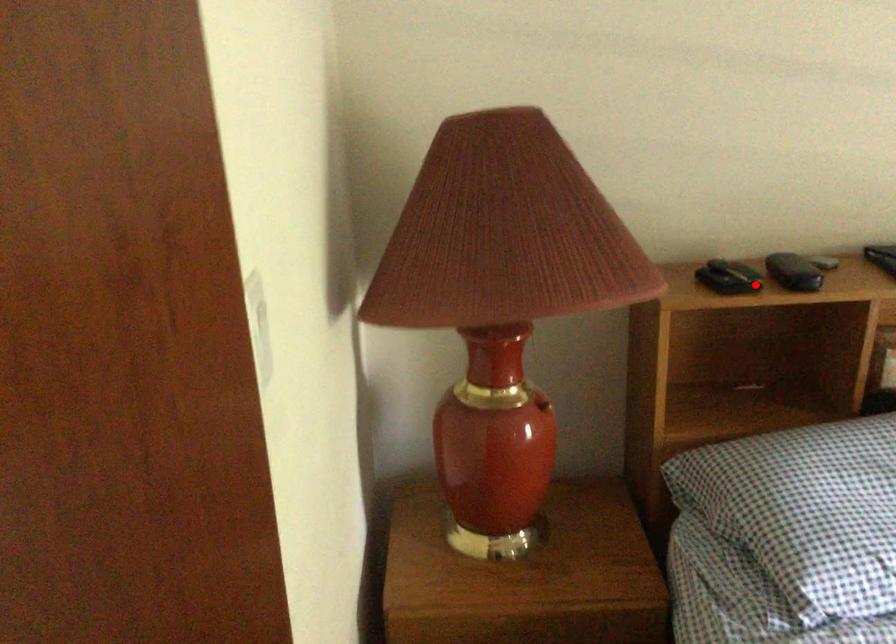
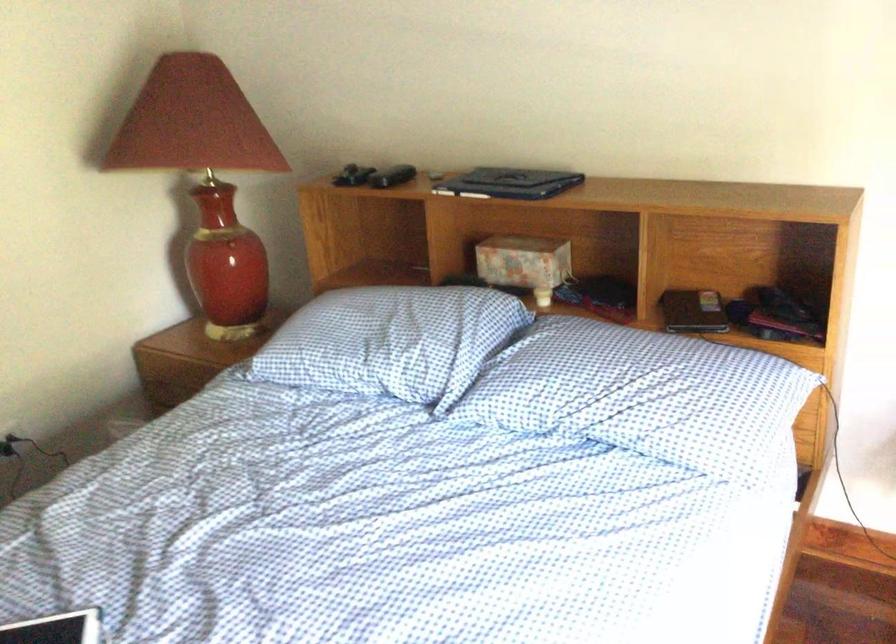
Where in the second image is the point corresponding to the highlighted location from the first image?

(352, 176)